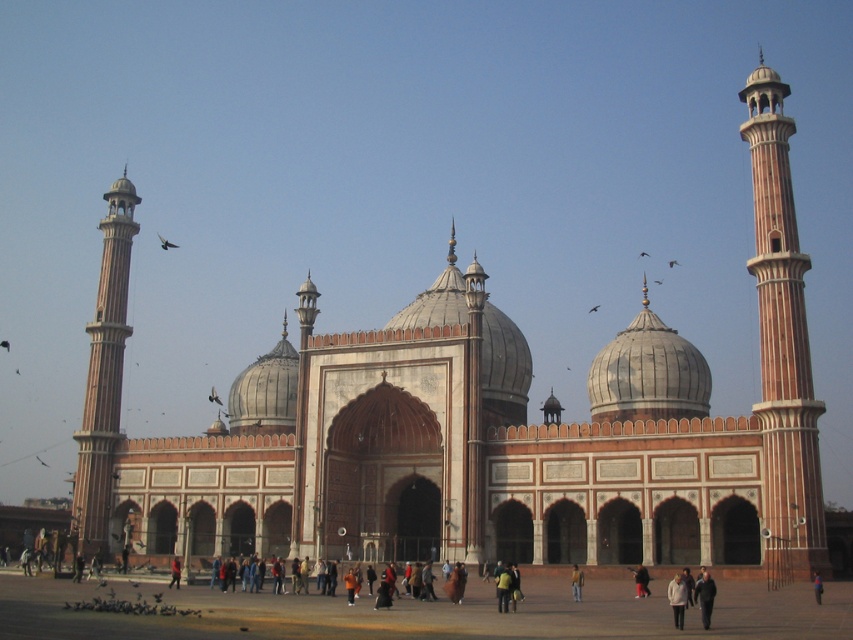
Question: Is reddish-brown stone minaret at left to the right of orange fabric jacket at center from the viewer's perspective?

Choices:
 (A) no
 (B) yes

Answer: (A)

Question: Is reddish-brown stone minaret at left bigger than orange fabric jacket at center?

Choices:
 (A) no
 (B) yes

Answer: (B)

Question: Among these objects, which one is nearest to the camera?

Choices:
 (A) reddish-brown stone minaret at left
 (B) reddish-brown stone minaret at right
 (C) orange fabric jacket at center

Answer: (C)

Question: Among these points, which one is farthest from the camera?

Choices:
 (A) (817, 582)
 (B) (106, 285)

Answer: (B)

Question: Is reddish-brown stone minaret at left to the right of orange fabric jacket at center from the viewer's perspective?

Choices:
 (A) yes
 (B) no

Answer: (B)

Question: Estimate the real-world distances between objects in this image. Which object is closer to the blue fabric person at center?

Choices:
 (A) reddish-brown stone minaret at left
 (B) orange fabric jacket at center

Answer: (B)